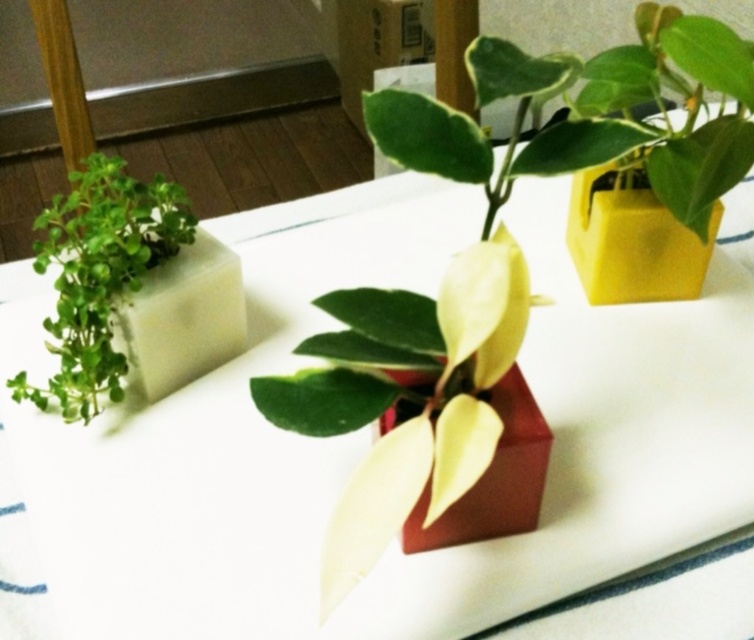
You are arranging plants on a shelf and need to know their sizes. Which object is wider between the green matte plant at left and the matte red cube at center?

The green matte plant at left is wider than the matte red cube at center according to their widths.

You are arranging plants on a table and want to place a new plant between the green matte plant at left and the matte red cube at center. Based on their positions, where should you place the new plant?

The green matte plant at left is located above the matte red cube at center, so placing a new plant between them would require positioning it below the green matte plant at left and above the matte red cube at center.

You are organizing items on a table and need to place a new object between the white matte cube at left and the green matte plant at left. Considering their sizes, which item should you place closer to the edge of the table to ensure stability?

The white matte cube at left is larger in size than the green matte plant at left, so placing the white matte cube at left closer to the edge would provide better stability due to its larger base.